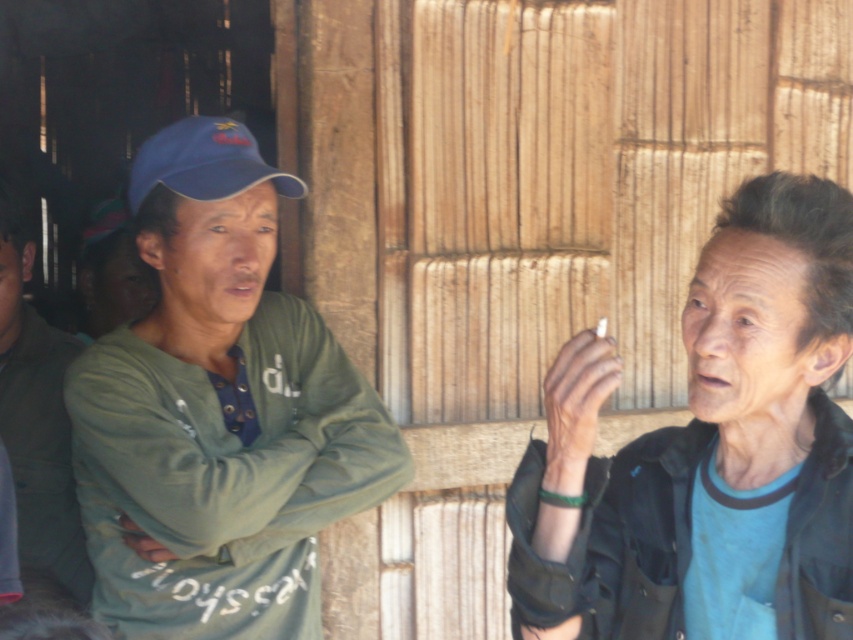
Measure the distance between blue fabric shirt at right and blue fabric baseball cap at upper left.

blue fabric shirt at right is 3.39 feet from blue fabric baseball cap at upper left.

Identify the location of blue fabric shirt at right. (706, 451).

Measure the distance between point (795, 388) and camera.

They are 2.27 meters apart.

The height and width of the screenshot is (640, 853). I want to click on blue fabric shirt at right, so click(706, 451).

Does green matte jacket at left have a smaller size compared to blue fabric baseball cap at upper left?

No, green matte jacket at left is not smaller than blue fabric baseball cap at upper left.

Between green matte jacket at left and blue fabric baseball cap at upper left, which one has more height?

green matte jacket at left

Locate an element on the screen. green matte jacket at left is located at coordinates (38, 419).

Measure the distance between blue fabric shirt at right and camera.

A distance of 6.86 feet exists between blue fabric shirt at right and camera.

Does blue fabric shirt at right have a larger size compared to green matte shirt at left?

No, blue fabric shirt at right is not bigger than green matte shirt at left.

The image size is (853, 640). Find the location of `blue fabric shirt at right`. blue fabric shirt at right is located at coordinates (706, 451).

This screenshot has width=853, height=640. What are the coordinates of `blue fabric shirt at right` in the screenshot? It's located at (706, 451).